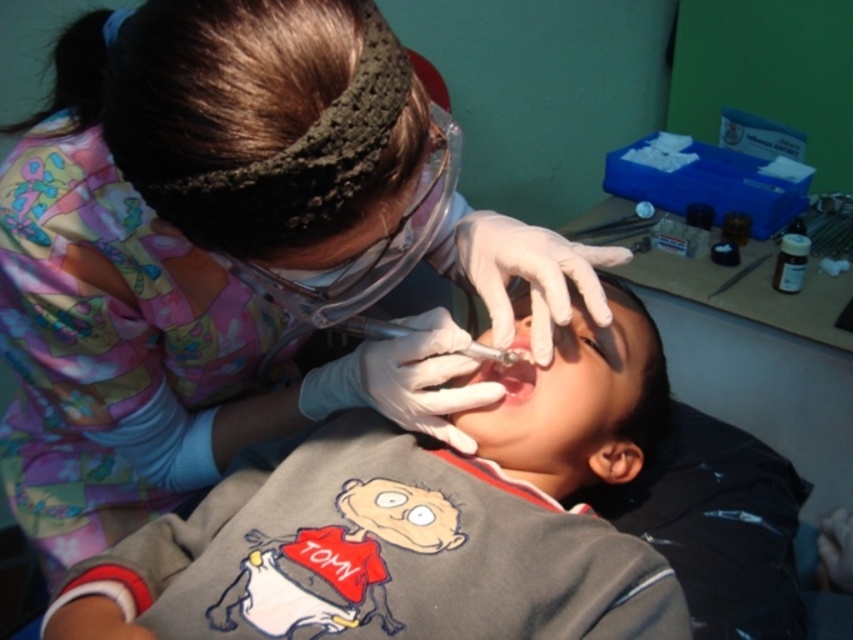
You are a dental assistant observing the scene. The child is wearing a gray cotton shirt at center and there is a metallic needle at center. Which object is positioned more to the left?

The gray cotton shirt at center is positioned more to the left than the metallic needle at center.

You are a dental assistant in a clinic. You need to place a 7.5 inch long medical tool on the tray. There is a matte white shirt at center and a gray cotton shirt at center on the tray. Can the tool fit between them without overlapping?

The distance between the matte white shirt at center and the gray cotton shirt at center is 7.20 inches. Since the tool is 7.5 inches long, it is slightly longer than the available space between them. Therefore, the tool cannot fit between them without overlapping.

You are a dental assistant and need to sterilize the point at coordinates point (527, 360). The sterilization equipment can only reach objects within 90 centimeters. Can you effectively sterilize the point?

The point (527, 360) is 87.95 centimeters from the viewer, which is within the 90 centimeter range of the sterilization equipment. Therefore, you can effectively sterilize the point.